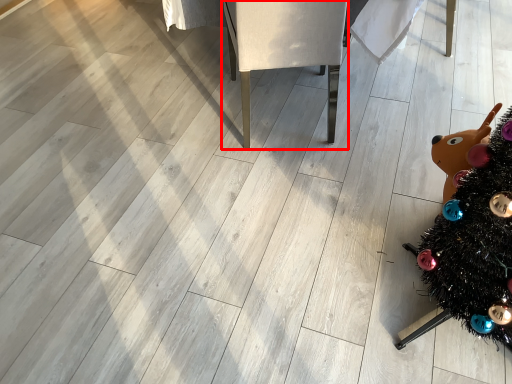
Question: In this image, where is furniture (annotated by the red box) located relative to christmas tree?

Choices:
 (A) right
 (B) left

Answer: (B)